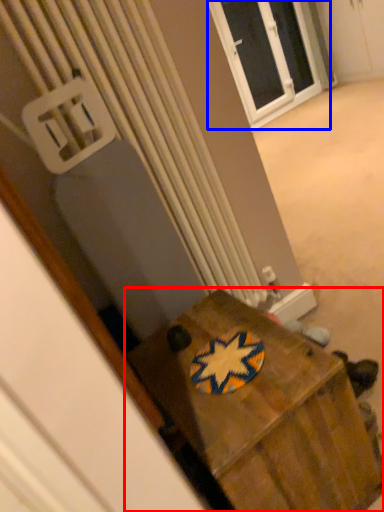
Question: Which object is further to the camera taking this photo, furniture (highlighted by a red box) or window (highlighted by a blue box)?

Choices:
 (A) furniture
 (B) window

Answer: (B)